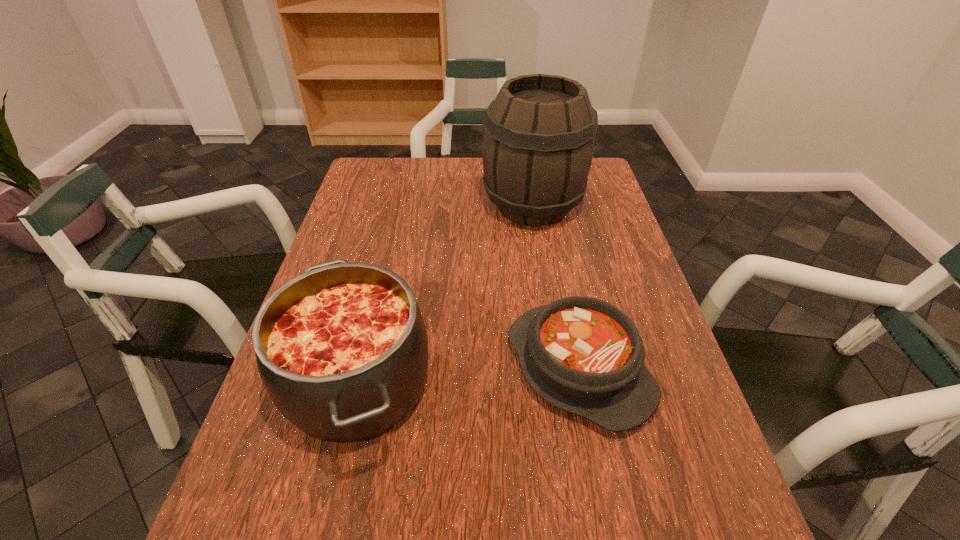
Image resolution: width=960 pixels, height=540 pixels. I want to click on object at the left edge, so click(342, 350).

Locate an element on the screen. The width and height of the screenshot is (960, 540). wine bucket situated at the right edge is located at coordinates (538, 143).

Locate an element on the screen. The width and height of the screenshot is (960, 540). casserole at the right edge is located at coordinates (583, 355).

Locate an element on the screen. object that is positioned at the far right corner is located at coordinates (538, 143).

I want to click on free space at the far edge, so click(425, 177).

You are a GUI agent. You are given a task and a screenshot of the screen. Output one action in this format:
    pyautogui.click(x=<x>, y=<y>)
    Task: Click on the vacant space at the left edge of the desktop
    The width and height of the screenshot is (960, 540).
    Given the screenshot: What is the action you would take?
    357,240

You are a GUI agent. You are given a task and a screenshot of the screen. Output one action in this format:
    pyautogui.click(x=<x>, y=<y>)
    Task: Click on the free spot at the right edge of the desktop
    This screenshot has height=540, width=960.
    Given the screenshot: What is the action you would take?
    pyautogui.click(x=704, y=470)

Find the location of a particular element. free space at the far left corner of the desktop is located at coordinates (384, 168).

Locate an element on the screen. unoccupied position between the tallest object and the second tallest object is located at coordinates (445, 294).

The height and width of the screenshot is (540, 960). Find the location of `vacant area that lies between the left casserole and the tallest object`. vacant area that lies between the left casserole and the tallest object is located at coordinates (445, 294).